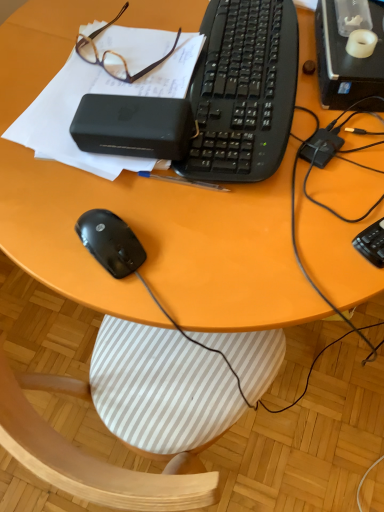
Identify the location of vacant area that is in front of black matte notepad at upper left. The height and width of the screenshot is (512, 384). (132, 228).